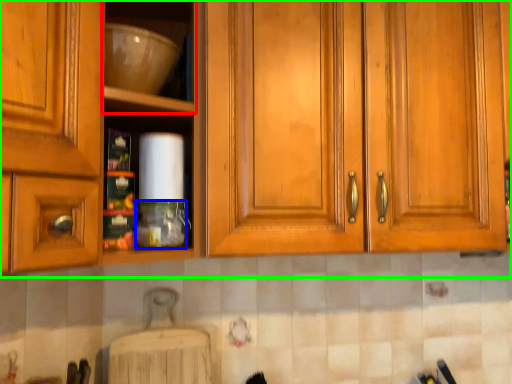
Question: Which object is positioned closest to shelf (highlighted by a red box)? Select from bottle (highlighted by a blue box) and cabinetry (highlighted by a green box).

Choices:
 (A) bottle
 (B) cabinetry

Answer: (B)